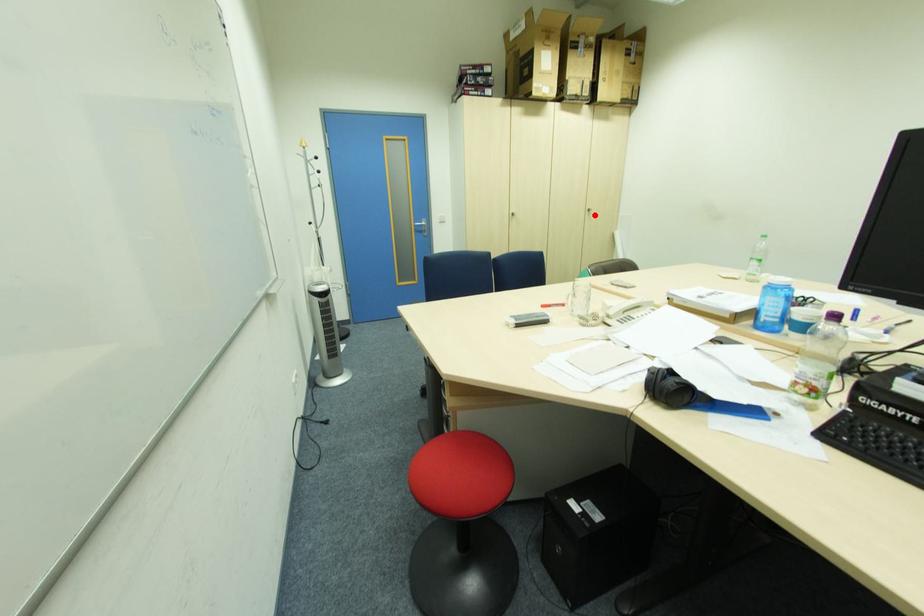
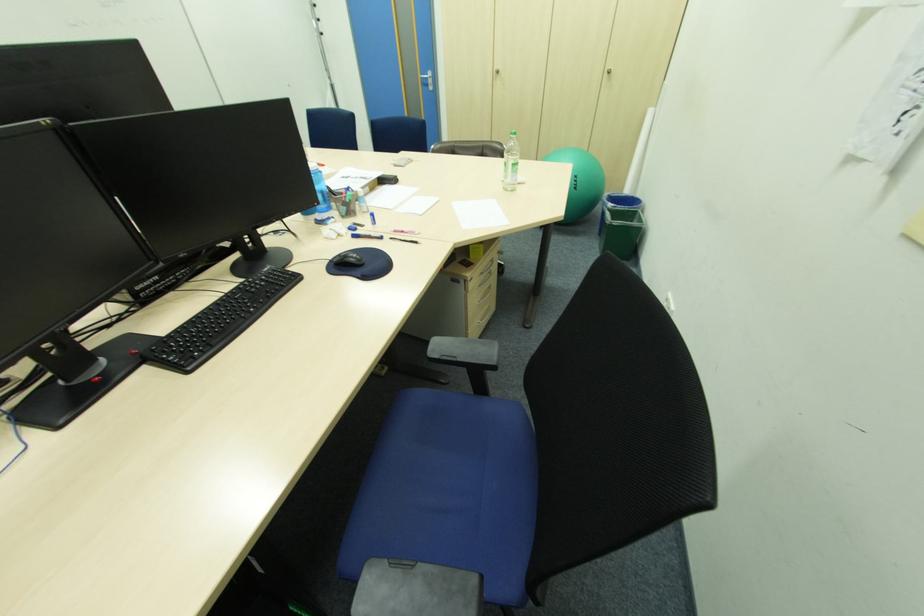
Locate, in the second image, the point that corresponds to the highlighted location in the first image.

(615, 79)